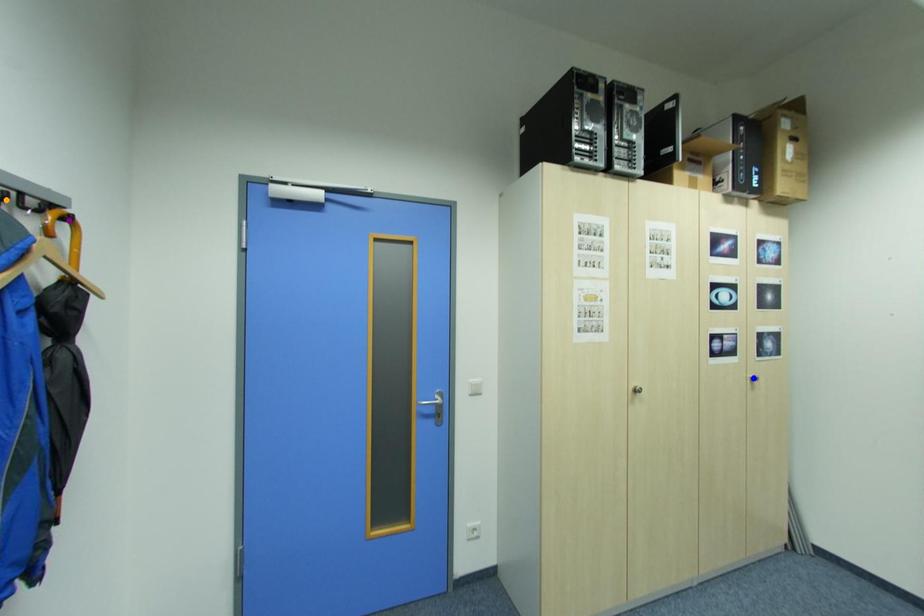
Order these from nearest to farthest:
A) orange point
B) purple point
C) blue point

blue point → purple point → orange point